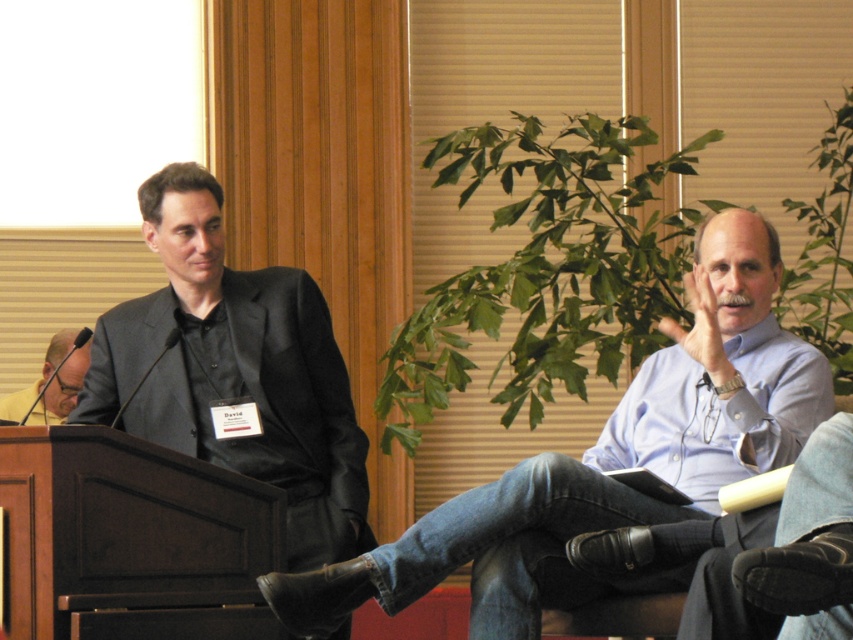
Does dark gray suit at left have a greater height compared to matte black suit at left?

Yes, dark gray suit at left is taller than matte black suit at left.

Between dark gray suit at left and matte black suit at left, which one appears on the left side from the viewer's perspective?

matte black suit at left is more to the left.

Which is in front, point (332, 554) or point (78, 371)?

Point (332, 554) is in front.

Find the location of a particular element. dark gray suit at left is located at coordinates (234, 371).

Can you confirm if blue shirt at right is taller than matte black suit at left?

Yes, blue shirt at right is taller than matte black suit at left.

Measure the distance between blue shirt at right and camera.

They are 4.31 meters apart.

Which is behind, point (662, 477) or point (78, 387)?

Point (78, 387)

The height and width of the screenshot is (640, 853). I want to click on blue shirt at right, so click(x=608, y=458).

The height and width of the screenshot is (640, 853). What do you see at coordinates (608, 458) in the screenshot?
I see `blue shirt at right` at bounding box center [608, 458].

Between point (480, 522) and point (171, 186), which one is positioned behind?

Point (171, 186)

Image resolution: width=853 pixels, height=640 pixels. Identify the location of blue shirt at right. (608, 458).

The height and width of the screenshot is (640, 853). I want to click on blue shirt at right, so click(x=608, y=458).